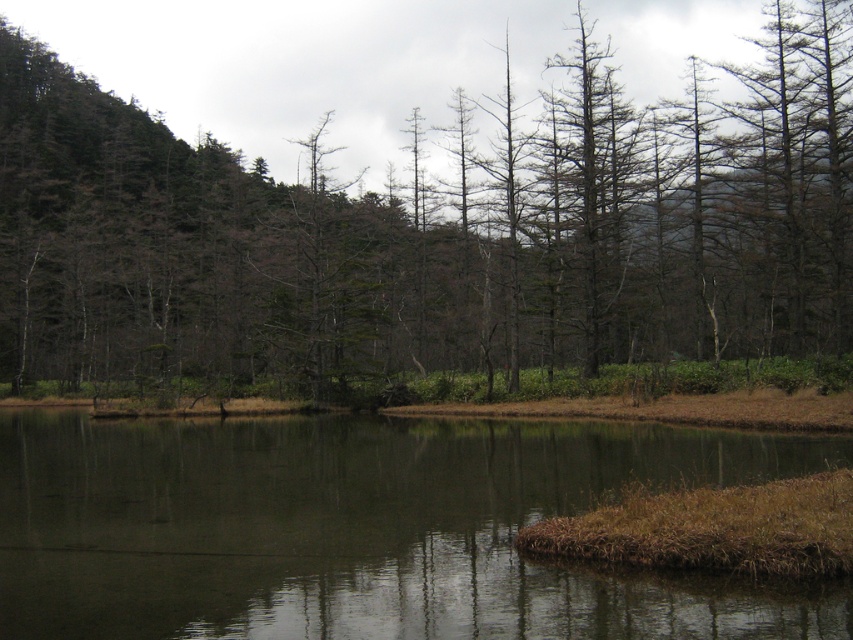
Does brown matte tree at center have a greater width compared to dark reflective water at center?

Correct, the width of brown matte tree at center exceeds that of dark reflective water at center.

In the scene shown: Does brown matte tree at center appear on the left side of dark reflective water at center?

Indeed, brown matte tree at center is positioned on the left side of dark reflective water at center.

Describe the element at coordinates (430, 236) in the screenshot. I see `brown matte tree at center` at that location.

Where is `brown matte tree at center`? The image size is (853, 640). brown matte tree at center is located at coordinates (430, 236).